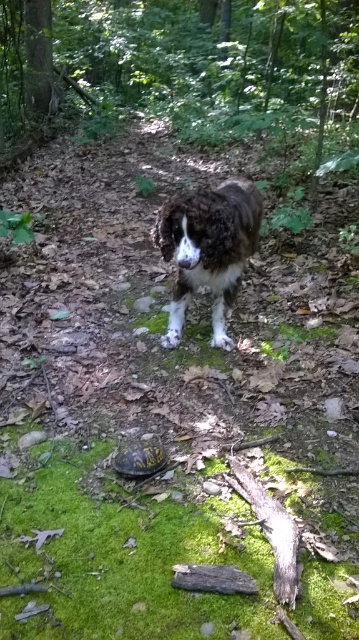
Based on the scene description and the coordinates provided, what does the point at (187,72) represent?

The point at (187,72) represents the green mossy forest at center as indicated by the coordinates.

Based on the scene description, where is the green mossy forest at center located in terms of its 2D coordinates?

The green mossy forest at center is located at the 2D coordinates point (187, 72).